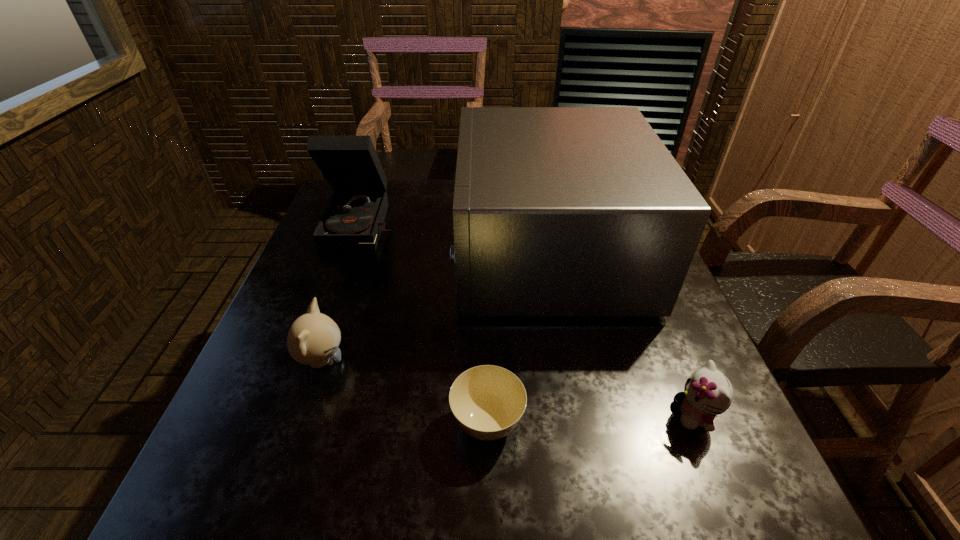
Locate an element on the screen. The image size is (960, 540). kitten that is at the right edge is located at coordinates (707, 392).

Find the location of a particular element. object that is at the far left corner is located at coordinates (354, 217).

This screenshot has height=540, width=960. Identify the location of object that is positioned at the far right corner. (558, 211).

In the image, there is a desktop. Where is `blank space at the far edge`? This screenshot has height=540, width=960. blank space at the far edge is located at coordinates (433, 195).

This screenshot has width=960, height=540. Identify the location of free spot at the near edge of the desktop. 371,464.

This screenshot has width=960, height=540. What are the coordinates of `vacant space at the left edge` in the screenshot? It's located at (304, 421).

Image resolution: width=960 pixels, height=540 pixels. Find the location of `vacant space at the right edge of the desktop`. vacant space at the right edge of the desktop is located at coordinates (659, 355).

Find the location of a particular element. vacant space that's between the third nearest object and the microwave oven is located at coordinates (435, 306).

I want to click on vacant point located between the shortest object and the microwave oven, so click(517, 337).

Locate an element on the screen. The width and height of the screenshot is (960, 540). free point between the phonograph_record and the right kitten is located at coordinates (529, 319).